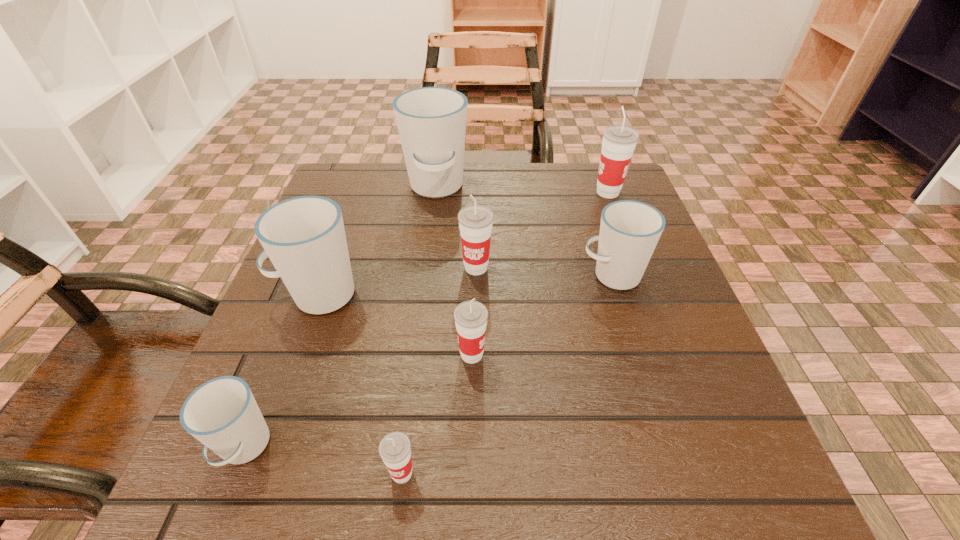
Locate an element on the screen. The height and width of the screenshot is (540, 960). free point that satisfies the following two spatial constraints: 1. on the side of the farthest red cup with the logo; 2. with a handle on the side of the smallest white cup is located at coordinates click(x=704, y=448).

In order to click on vacant space that satisfies the following two spatial constraints: 1. on the side of the third nearest red cup with the logo; 2. with a handle on the side of the third smallest white cup in this screenshot , I will do `click(476, 295)`.